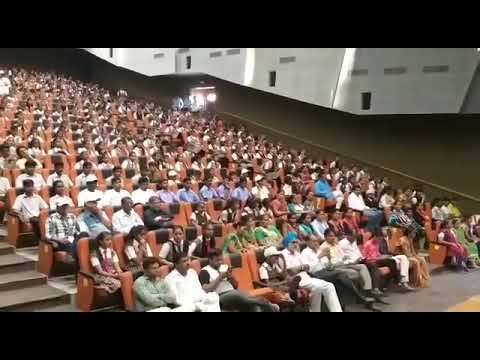
Where is `brown wall`? The width and height of the screenshot is (480, 360). brown wall is located at coordinates (348, 130).